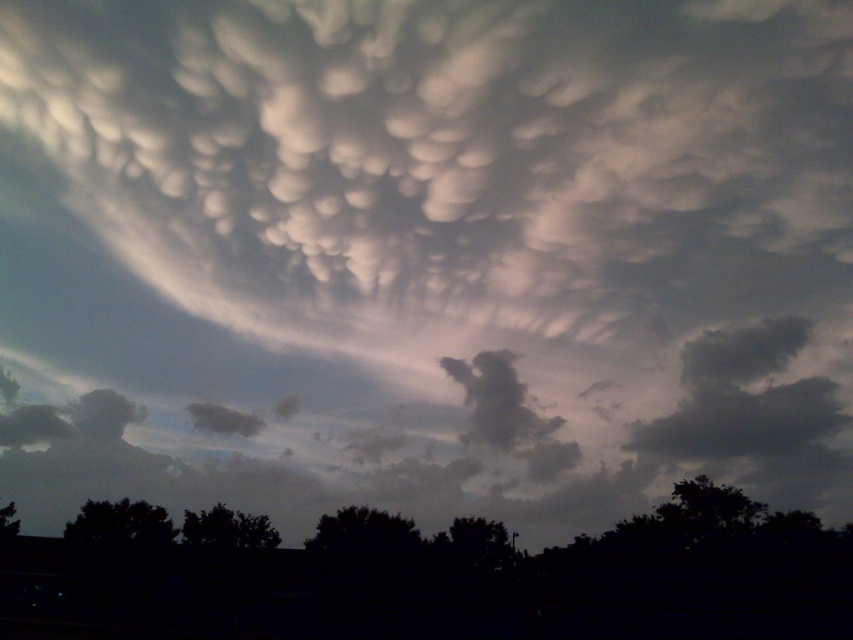
Question: Observing the image, what is the correct spatial positioning of dark green leafy tree at center in reference to green leafy tree at center?

Choices:
 (A) left
 (B) right

Answer: (A)

Question: Which object is closer to the camera taking this photo?

Choices:
 (A) dark green leafy tree at center
 (B) dark green leafy tree at lower right

Answer: (A)

Question: Is dark green leafy tree at lower right to the left of green leafy tree at center from the viewer's perspective?

Choices:
 (A) no
 (B) yes

Answer: (A)

Question: Observing the image, what is the correct spatial positioning of dark green leafy tree at lower left in reference to green leafy tree at lower left?

Choices:
 (A) left
 (B) right

Answer: (B)

Question: Which point appears closest to the camera in this image?

Choices:
 (A) (753, 504)
 (B) (239, 515)

Answer: (B)

Question: Which point is farther to the camera?

Choices:
 (A) (13, 518)
 (B) (737, 528)
 (C) (219, 529)
 (D) (450, 548)

Answer: (A)